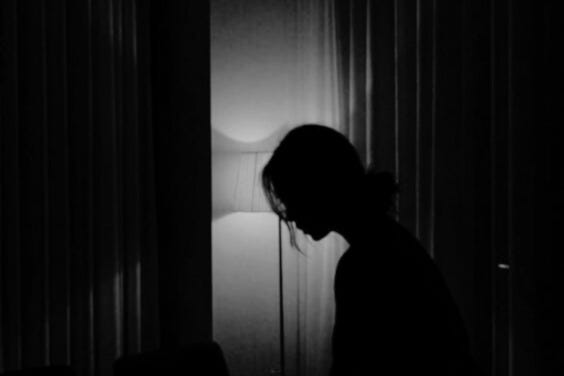
Find the location of `grey curtains`. grey curtains is located at coordinates (380, 97).